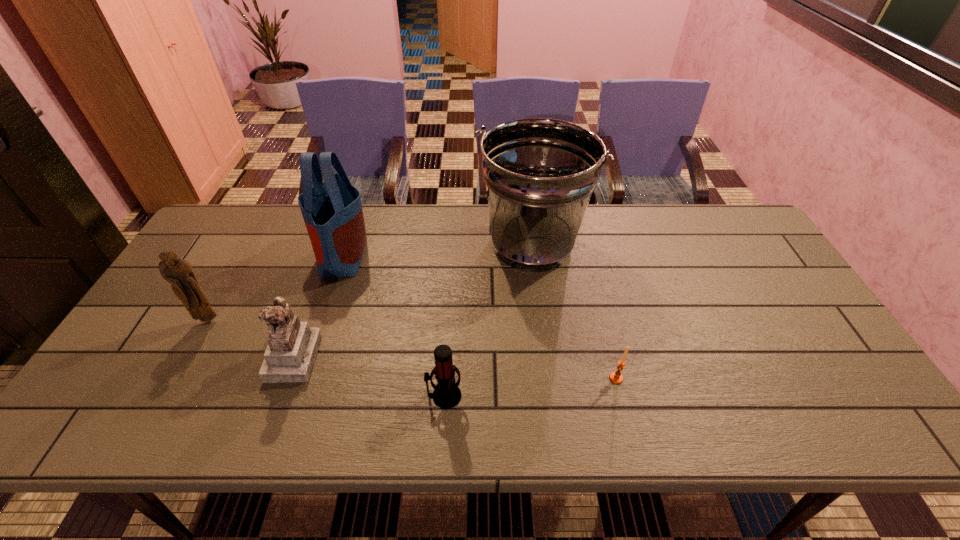
At what (x,y) coordinates should I click in order to perform the action: click on vacant space at the near edge of the desktop. Please return your answer as a coordinate pair (x, y). Looking at the image, I should click on (412, 423).

The width and height of the screenshot is (960, 540). I want to click on free location at the right edge, so click(x=836, y=366).

In the image, there is a desktop. At what (x,y) coordinates should I click in order to perform the action: click on free space at the far right corner. Please return your answer as a coordinate pair (x, y). Looking at the image, I should click on (690, 206).

In order to click on free space between the fifth tallest object and the left figurine in this screenshot , I will do `click(326, 358)`.

I want to click on vacant space that is in between the fourth shortest object and the bucket, so click(x=370, y=282).

In order to click on free space between the shorter figurine and the third tallest object in this screenshot , I will do `click(252, 339)`.

The width and height of the screenshot is (960, 540). Identify the location of vacant area that lies between the fourth nearest object and the fourth object from left to right. (326, 358).

This screenshot has width=960, height=540. I want to click on free spot between the microphone and the left figurine, so click(x=326, y=358).

Where is `unoccupied area between the farther figurine and the candle_holder`? unoccupied area between the farther figurine and the candle_holder is located at coordinates (413, 349).

At what (x,y) coordinates should I click in order to perform the action: click on free space between the microphone and the leftmost object. Please return your answer as a coordinate pair (x, y). This screenshot has width=960, height=540. Looking at the image, I should click on (326, 358).